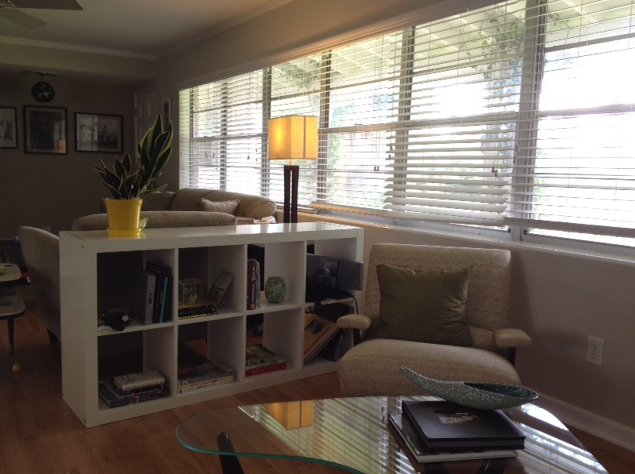
Locate an element on the screen. The height and width of the screenshot is (474, 635). chair is located at coordinates (370, 360).